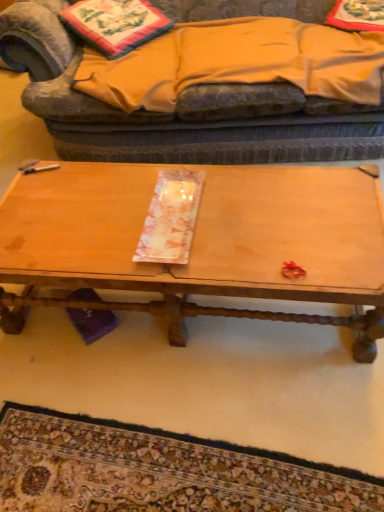
Find the location of `free point above carpet with intricate patterns at lower center (from a real-world perspective)`. free point above carpet with intricate patterns at lower center (from a real-world perspective) is located at coordinates 135,470.